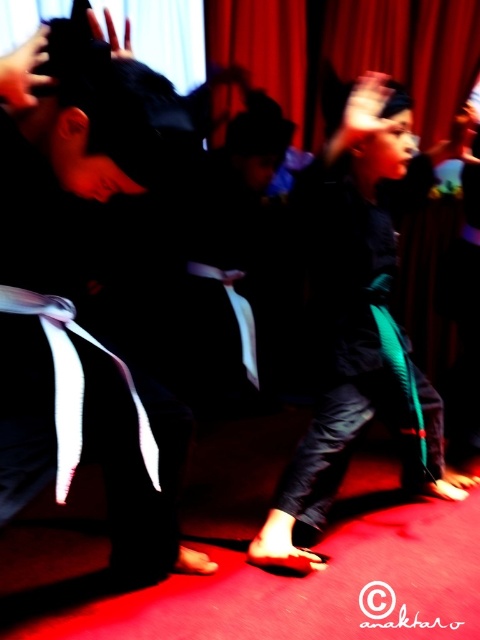
Question: Is matte black belt at left thinner than teal fabric pants at center?

Choices:
 (A) yes
 (B) no

Answer: (A)

Question: Is matte black belt at left bigger than teal fabric pants at center?

Choices:
 (A) no
 (B) yes

Answer: (A)

Question: Which object appears farthest from the camera in this image?

Choices:
 (A) teal fabric pants at center
 (B) matte black belt at left

Answer: (A)

Question: Which of the following is the closest to the observer?

Choices:
 (A) teal fabric pants at center
 (B) matte black belt at left

Answer: (B)

Question: Does matte black belt at left have a lesser width compared to teal fabric pants at center?

Choices:
 (A) yes
 (B) no

Answer: (A)